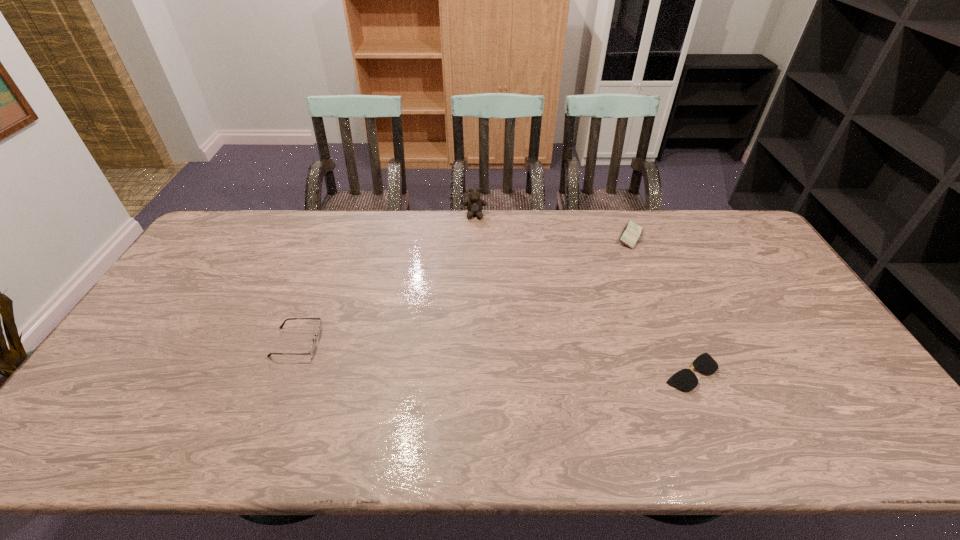
Image resolution: width=960 pixels, height=540 pixels. What are the coordinates of `vacant point located between the diary and the farthest object` in the screenshot? It's located at (552, 226).

This screenshot has width=960, height=540. Identify the location of vacant space that is in between the tallest object and the second farthest object. (552, 226).

This screenshot has width=960, height=540. Identify the location of free spot between the right spectacles and the third nearest object. (660, 305).

You are a GUI agent. You are given a task and a screenshot of the screen. Output one action in this format:
    pyautogui.click(x=<x>, y=<y>)
    Task: Click on the free spot between the shorter spectacles and the left spectacles
    The image size is (960, 540).
    Given the screenshot: What is the action you would take?
    pyautogui.click(x=493, y=357)

Image resolution: width=960 pixels, height=540 pixels. Find the location of `vacant region between the diary and the teddy bear`. vacant region between the diary and the teddy bear is located at coordinates (552, 226).

What are the coordinates of `vacant space that is in between the tallest object and the third nearest object` in the screenshot? It's located at (552, 226).

Identify the location of free space between the farthest object and the leftmost object. Image resolution: width=960 pixels, height=540 pixels. (386, 279).

The width and height of the screenshot is (960, 540). I want to click on free spot between the leftmost object and the shortest object, so click(x=493, y=357).

Locate an element on the screen. The image size is (960, 540). free spot between the leftmost object and the third nearest object is located at coordinates click(464, 289).

Identify which object is the closest to the tallest object. Please provide its 2D coordinates. Your answer should be formatted as a tuple, i.e. [(x, y)], where the tuple contains the x and y coordinates of a point satisfying the conditions above.

[(631, 233)]